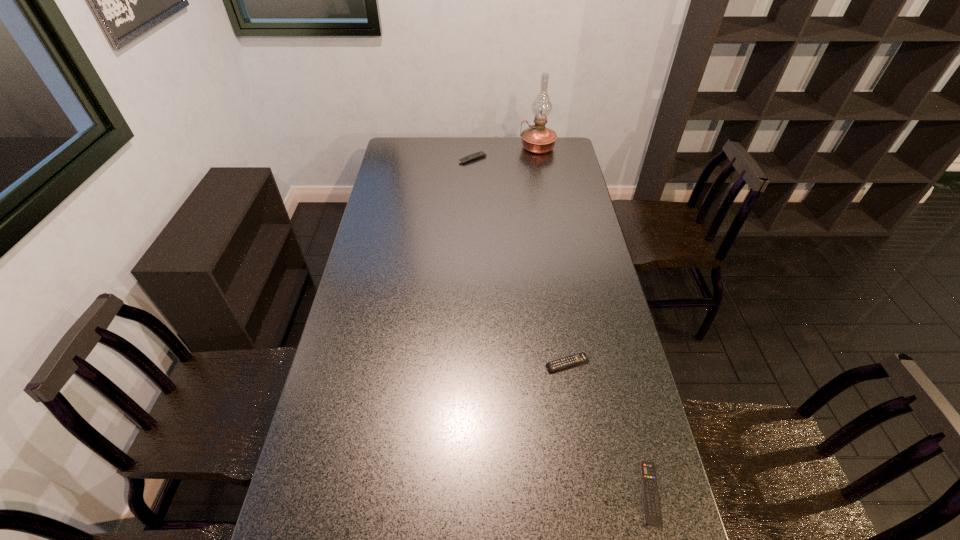
You are a GUI agent. You are given a task and a screenshot of the screen. Output one action in this format:
    pyautogui.click(x=<x>, y=<y>)
    Task: Click on the tallest object
    
    Given the screenshot: What is the action you would take?
    pyautogui.click(x=538, y=139)

This screenshot has width=960, height=540. I want to click on the leftmost object, so (480, 154).

This screenshot has height=540, width=960. In order to click on the tallest remote control in this screenshot , I will do `click(480, 154)`.

Find the location of a particular element. Image resolution: width=960 pixels, height=540 pixels. the third tallest object is located at coordinates (581, 357).

At what (x,y) coordinates should I click in order to perform the action: click on the second remote control from right to left. Please return your answer as a coordinate pair (x, y). Looking at the image, I should click on (581, 357).

Where is `the rightmost remote control`? The height and width of the screenshot is (540, 960). the rightmost remote control is located at coordinates (653, 514).

Locate an element on the screen. The width and height of the screenshot is (960, 540). the rightmost object is located at coordinates (653, 514).

Where is `vacant space located 0.130m on the front of the tallest object`? The image size is (960, 540). vacant space located 0.130m on the front of the tallest object is located at coordinates (541, 171).

Identify the location of vacant point located on the front of the tallest remote control. (472, 172).

Where is `vacant space located 0.220m on the front of the second shortest remote control`? The height and width of the screenshot is (540, 960). vacant space located 0.220m on the front of the second shortest remote control is located at coordinates (581, 445).